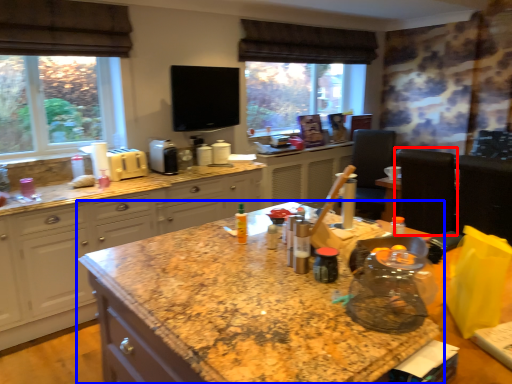
Question: Which object is further to the camera taking this photo, chair (highlighted by a red box) or countertop (highlighted by a blue box)?

Choices:
 (A) chair
 (B) countertop

Answer: (A)